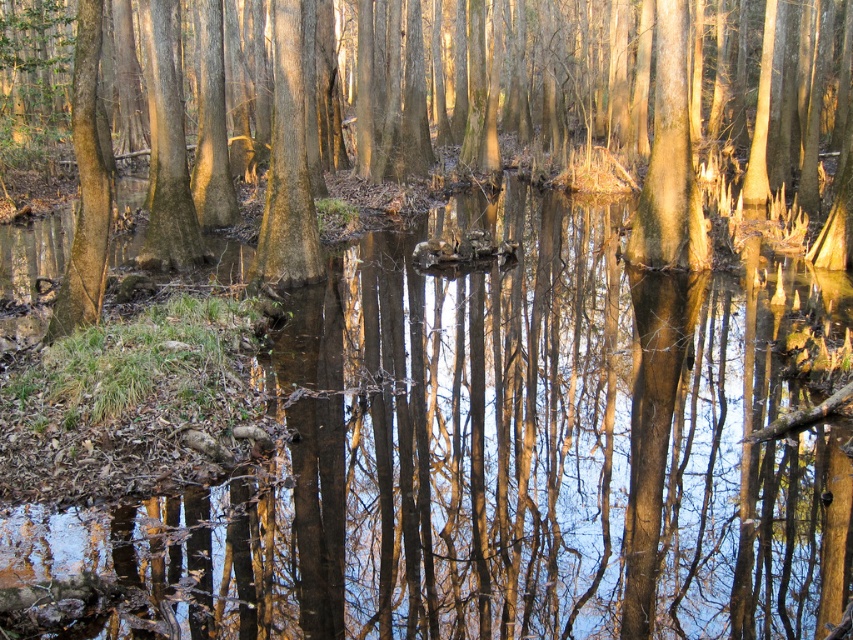
Question: Is clear water at center wider than smooth brown tree trunk at center?

Choices:
 (A) no
 (B) yes

Answer: (A)

Question: Which point is farther to the camera?

Choices:
 (A) (332, 465)
 (B) (576, 38)

Answer: (B)

Question: Can you confirm if clear water at center is bigger than smooth brown tree trunk at center?

Choices:
 (A) no
 (B) yes

Answer: (A)

Question: Which point is farther to the camera?

Choices:
 (A) clear water at center
 (B) smooth brown tree trunk at center

Answer: (B)

Question: Is clear water at center in front of smooth brown tree trunk at center?

Choices:
 (A) no
 (B) yes

Answer: (B)

Question: Which of the following is the closest to the observer?

Choices:
 (A) (531, 10)
 (B) (357, 301)

Answer: (B)